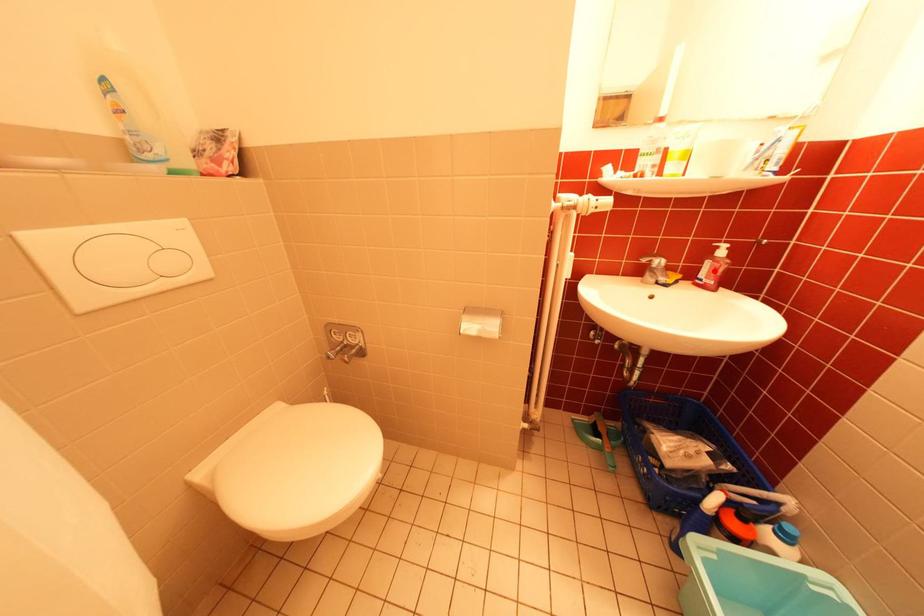
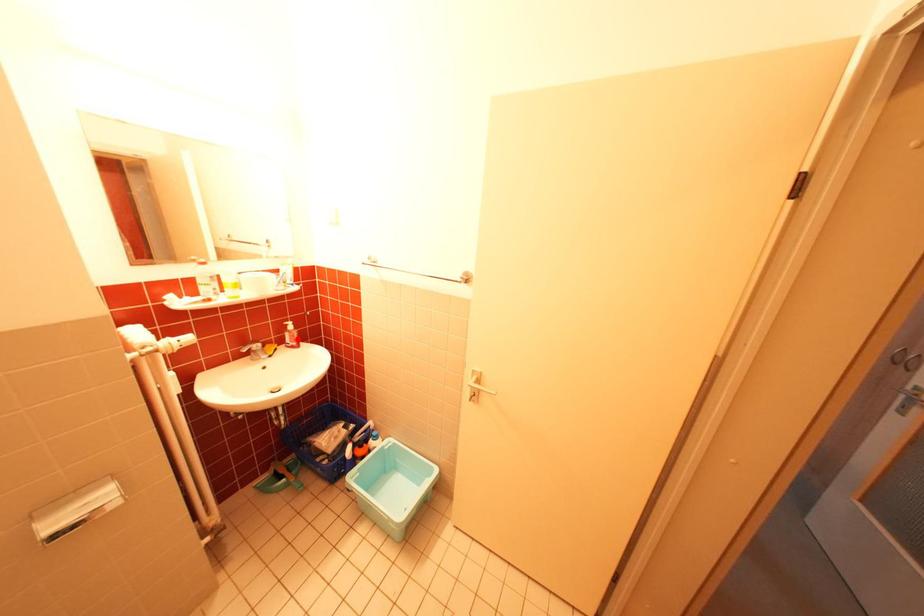
I am providing you with two images of the same scene from different viewpoints. A red point is marked on the first image and another point is marked on the second image. Is the marked point in image1 the same physical position as the marked point in image2?

Yes